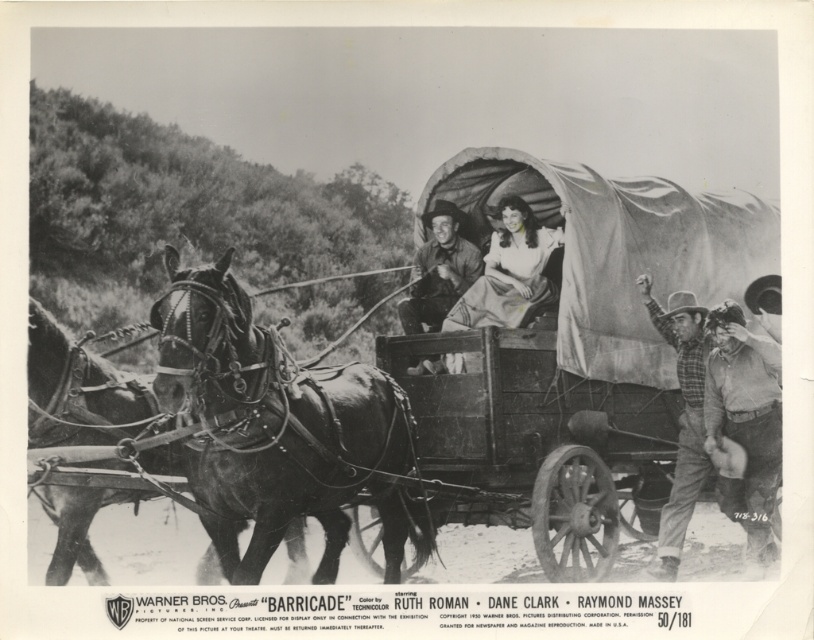
Consider the image. You are a traveler standing near the wagon and see the leather hat at right and the plaid flannel shirt at right. Which item is positioned more to the right side?

The leather hat at right is positioned more to the right than the plaid flannel shirt at right.

You are a costume designer preparing for a Western film scene. You notice two items in the image that are both at the right side of the frame. Which item is located lower between the leather hat at right and the plaid flannel shirt at right?

The leather hat at right is positioned under the plaid flannel shirt at right, so the leather hat at right is lower.

You are a stunt coordinator planning a scene where an actor needs to throw a rope from the camera position to the leather hat at right. The rope you have is 80 feet long. Can the actor reach the hat with the rope?

The leather hat at right is 82.67 feet from camera. The rope is only 80 feet long, so the actor cannot reach the hat with the rope.